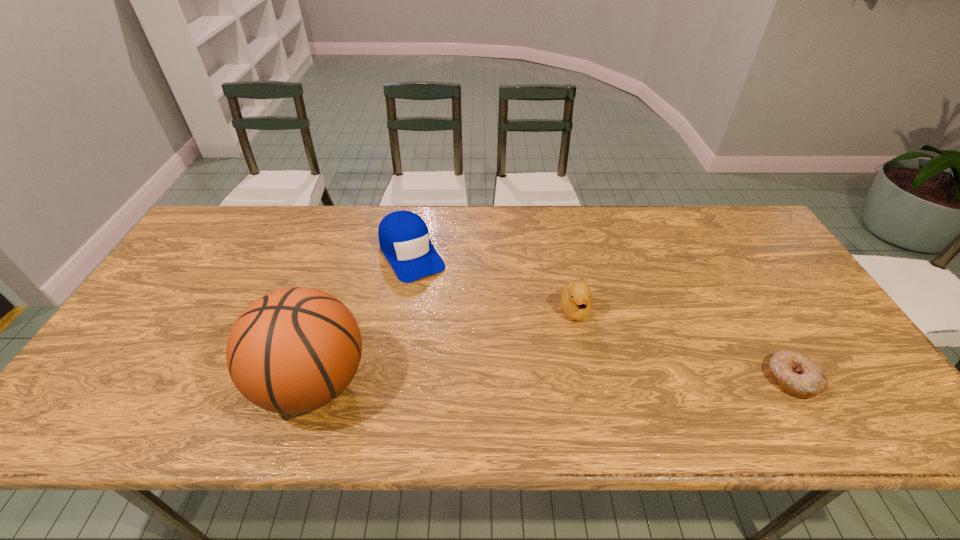
Identify the location of vacant space situated on the front-facing side of the baseball cap. This screenshot has height=540, width=960. (468, 350).

I want to click on vacant space located on the face of the third nearest object, so 592,388.

Where is `free location located 0.100m on the face of the third nearest object`? free location located 0.100m on the face of the third nearest object is located at coordinates (586, 360).

The image size is (960, 540). I want to click on object situated at the far edge, so click(x=404, y=238).

Identify the location of basketball present at the near edge. This screenshot has width=960, height=540. tap(292, 351).

Where is `doughnut that is at the near edge`? doughnut that is at the near edge is located at coordinates (798, 375).

The height and width of the screenshot is (540, 960). Identify the location of object situated at the right edge. (798, 375).

This screenshot has width=960, height=540. What are the coordinates of `object situated at the near right corner` in the screenshot? It's located at pyautogui.click(x=798, y=375).

This screenshot has height=540, width=960. What are the coordinates of `vacant space at the far edge` in the screenshot? It's located at (544, 214).

Find the location of a particular element. free spot at the left edge of the desktop is located at coordinates (151, 351).